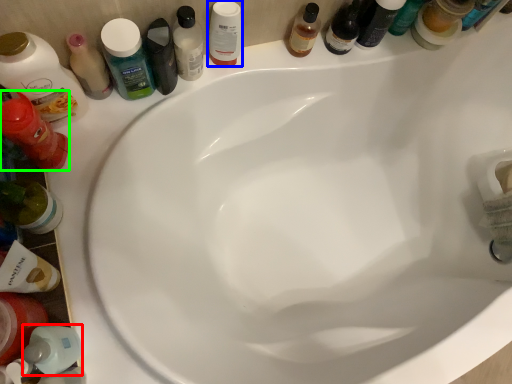
Question: Based on their relative distances, which object is farther from toiletry (highlighted by a red box)? Choose from mouthwash (highlighted by a blue box) and toiletry (highlighted by a green box).

Choices:
 (A) mouthwash
 (B) toiletry

Answer: (A)